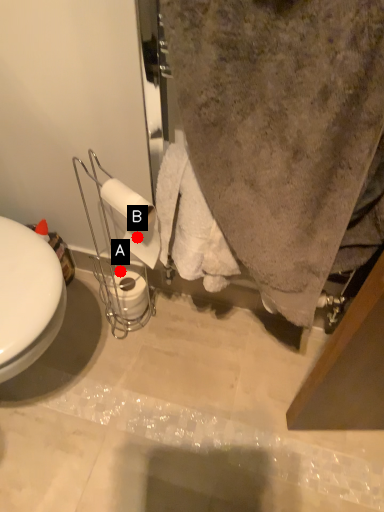
Question: Two points are circled on the image, labeled by A and B beside each circle. Among these points, which one is farthest from the camera?

Choices:
 (A) A is further
 (B) B is further

Answer: (A)